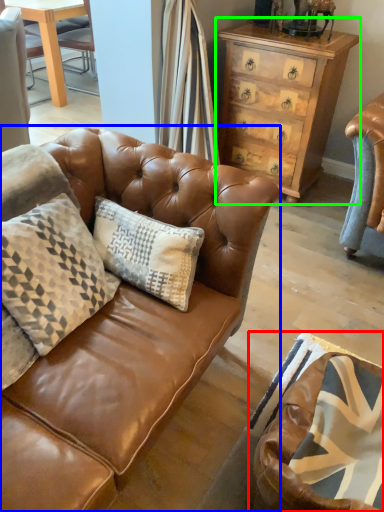
Question: Which is nearer to the swivel chair (highlighted by a red box)? studio couch (highlighted by a blue box) or chest of drawers (highlighted by a green box).

Choices:
 (A) studio couch
 (B) chest of drawers

Answer: (A)